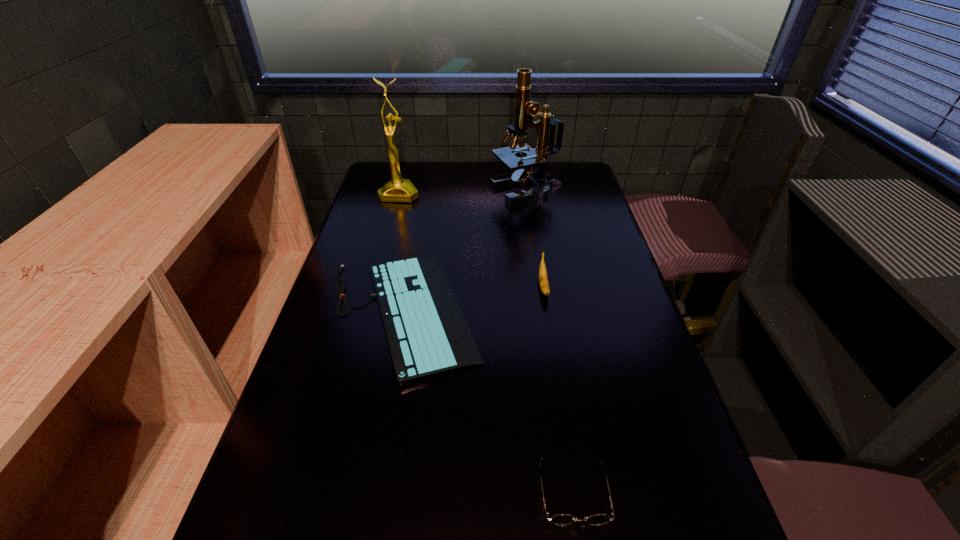
At what (x,y) coordinates should I click in order to perform the action: click on microscope. Please return your answer as a coordinate pair (x, y). This screenshot has width=960, height=540. Looking at the image, I should click on (525, 109).

The height and width of the screenshot is (540, 960). In order to click on award in this screenshot , I will do `click(398, 189)`.

You are a GUI agent. You are given a task and a screenshot of the screen. Output one action in this format:
    pyautogui.click(x=<x>, y=<y>)
    Task: Click on the banana
    This screenshot has height=540, width=960.
    Given the screenshot: What is the action you would take?
    pyautogui.click(x=543, y=279)

Image resolution: width=960 pixels, height=540 pixels. In order to click on the fourth tallest object in this screenshot , I will do `click(560, 519)`.

Find the location of a particular element. spectacles is located at coordinates (560, 519).

The width and height of the screenshot is (960, 540). What are the coordinates of `computer keyboard` in the screenshot? It's located at (427, 335).

I want to click on vacant space located at the eyepiece of the microscope, so (445, 191).

Identify the location of free point located 0.340m at the eyepiece of the microscope. (396, 191).

Where is `vacant space situated at the eyepiece of the microscope`? vacant space situated at the eyepiece of the microscope is located at coordinates (405, 191).

Identify the location of free space located 0.210m on the front-facing side of the award. (387, 239).